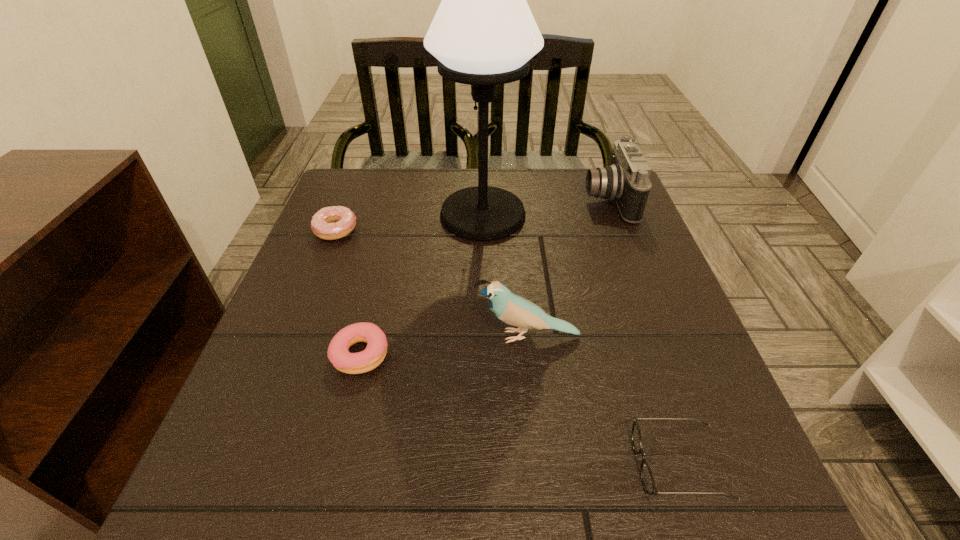
Locate an element on the screen. The height and width of the screenshot is (540, 960). table lamp that is at the far edge is located at coordinates (483, 34).

Where is `camera present at the far edge`? camera present at the far edge is located at coordinates click(626, 182).

Locate an element on the screen. doughnut that is at the far edge is located at coordinates (322, 224).

Locate an element on the screen. object situated at the near edge is located at coordinates (648, 482).

Find the location of a particular element. The width and height of the screenshot is (960, 540). camera present at the right edge is located at coordinates (626, 182).

At what (x,y) coordinates should I click in order to perform the action: click on spectacles located in the right edge section of the desktop. Please return your answer as a coordinate pair (x, y). Image resolution: width=960 pixels, height=540 pixels. Looking at the image, I should click on (648, 482).

I want to click on object that is at the far left corner, so click(322, 224).

Find the location of a particular element. The width and height of the screenshot is (960, 540). object located at the far right corner is located at coordinates pos(626,182).

Image resolution: width=960 pixels, height=540 pixels. Find the location of `object located in the near right corner section of the desktop`. object located in the near right corner section of the desktop is located at coordinates (648, 482).

The height and width of the screenshot is (540, 960). What are the coordinates of `vacant space at the far edge of the desktop` in the screenshot? It's located at (526, 205).